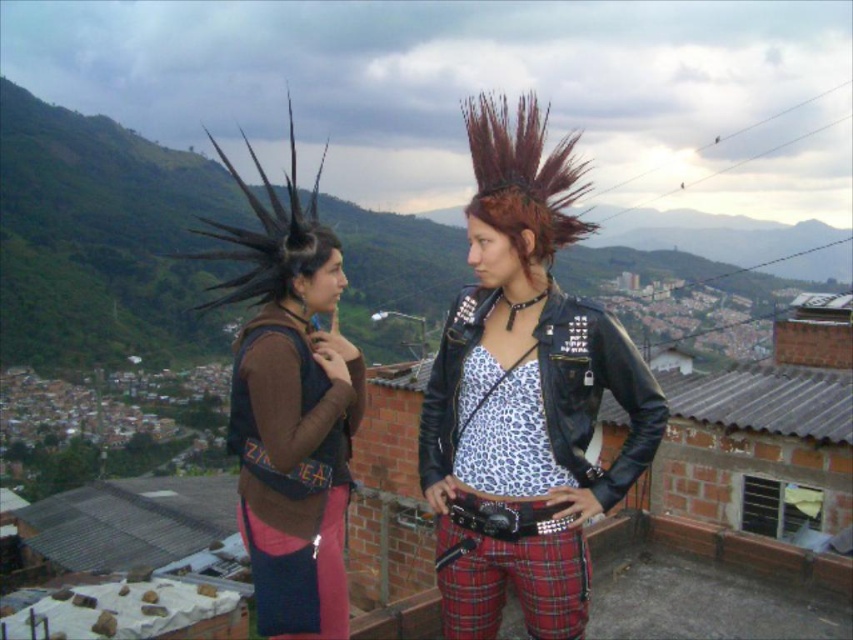
You are a photographer trying to capture a clear shot of both the leather jacket at center and the dark brown mohawk at center in the same frame. Based on their heights, which object should you focus on first to ensure both are in the frame?

The leather jacket at center is shorter than the dark brown mohawk at center, so you should focus on the dark brown mohawk at center first to ensure both are in the frame.

From the picture: You are trying to determine which object is wider between the black leather jacket at center and the dark brown mohawk at center. Based on the scene, which one is wider?

The dark brown mohawk at center is wider than the black leather jacket at center.